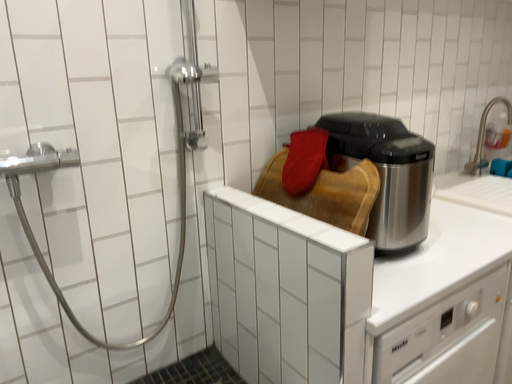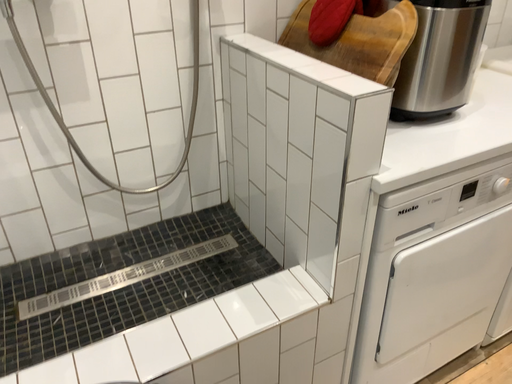
Question: How did the camera likely rotate when shooting the video?

Choices:
 (A) rotated right
 (B) rotated left

Answer: (B)